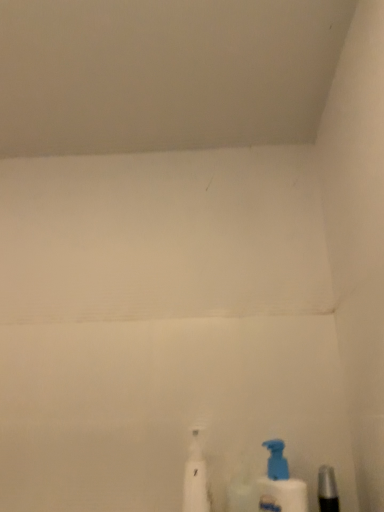
Question: Does point (288, 498) appear closer or farther from the camera than point (203, 502)?

Choices:
 (A) closer
 (B) farther

Answer: (A)

Question: Based on their sizes in the image, would you say blue plastic bottle at lower right is bigger or smaller than white plastic spray bottle at lower center?

Choices:
 (A) small
 (B) big

Answer: (A)

Question: Which object is positioned farthest from the white plastic spray bottle at lower center?

Choices:
 (A) metallic silver razor at lower right
 (B) blue plastic bottle at lower right

Answer: (A)

Question: Considering the real-world distances, which object is closest to the white plastic spray bottle at lower center?

Choices:
 (A) metallic silver razor at lower right
 (B) blue plastic bottle at lower right

Answer: (B)